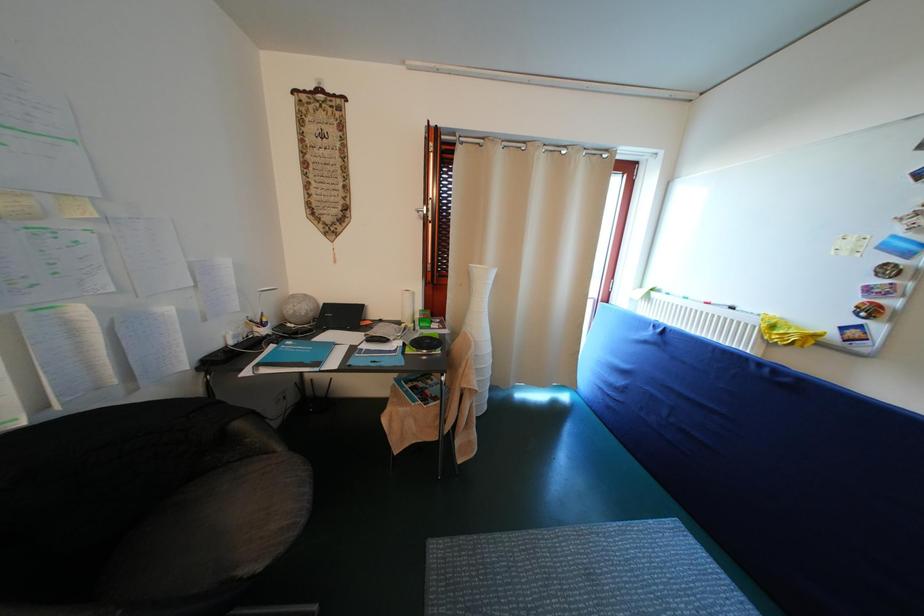
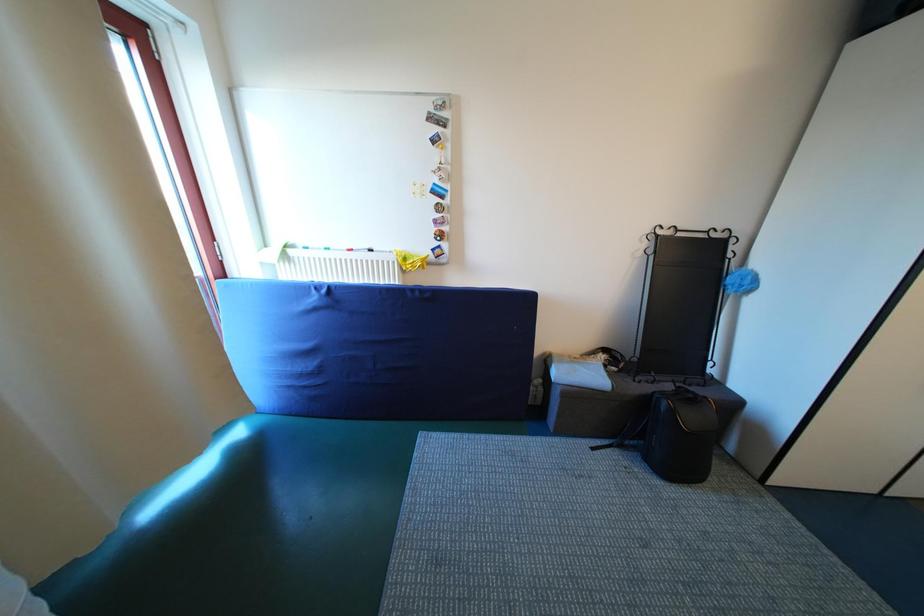
Based on the continuous images, in which direction is the camera rotating?

The camera's rotation is toward right-down.